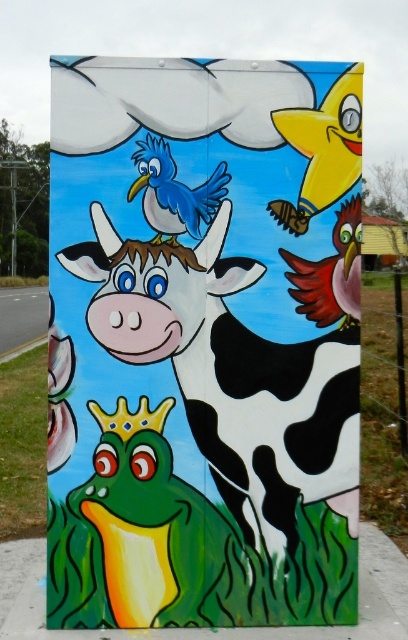
You are an artist who wants to add a new element to the mural. You have a sticker of a butterfly that you want to place between the shiny yellow bird at upper right and the matte blue bird at upper center. Can you fit it there?

The shiny yellow bird at upper right is positioned over matte blue bird at upper center, so there is no space between them to place the butterfly sticker.

You are an artist who wants to add a new element to the mural. You have a small butterfly sticker that is 2 inches wide. If you place it exactly halfway between the shiny yellow bird at upper right and the matte blue bird at upper center, will the butterfly fit without overlapping either bird?

The distance between the shiny yellow bird at upper right and the matte blue bird at upper center is 16.75 inches. Half of that distance is 8.375 inches. Since the butterfly is only 2 inches wide, placing it halfway would leave enough space on both sides, so it won